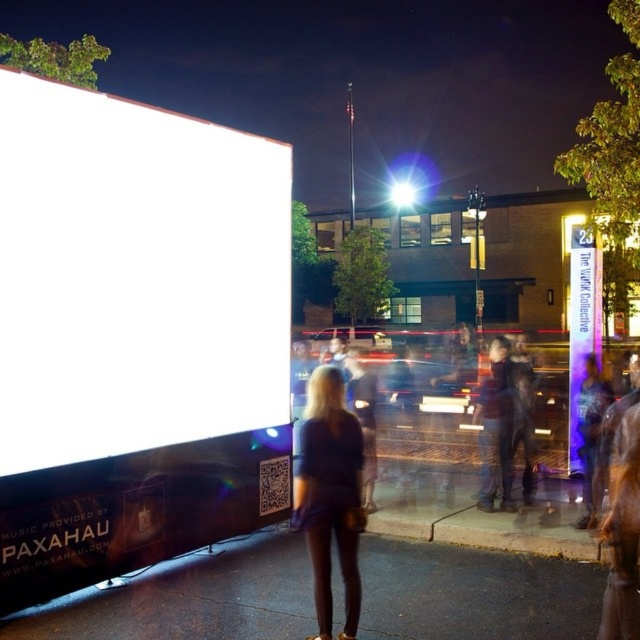
Does dark blue fabric dress at center appear over translucent purple sign at center?

No.

Is the position of dark blue fabric dress at center less distant than that of translucent purple sign at center?

That is True.

Find the location of a particular element. This screenshot has width=640, height=640. dark blue fabric dress at center is located at coordinates (330, 493).

Which is below, white glossy screen at upper left or dark blue fabric dress at center?

dark blue fabric dress at center is below.

Identify the location of white glossy screen at upper left. (134, 276).

Does point (244, 300) come behind point (346, 588)?

Yes, it is.

Where is `white glossy screen at upper left`? This screenshot has width=640, height=640. white glossy screen at upper left is located at coordinates (134, 276).

Between point (33, 445) and point (580, 358), which one is positioned behind?

Positioned behind is point (580, 358).

Is point (230, 368) less distant than point (570, 422)?

Yes.

Is point (120, 438) positioned behind point (572, 371)?

No, (120, 438) is in front of (572, 371).

Where is `white glossy screen at upper left`? The height and width of the screenshot is (640, 640). white glossy screen at upper left is located at coordinates coord(134,276).